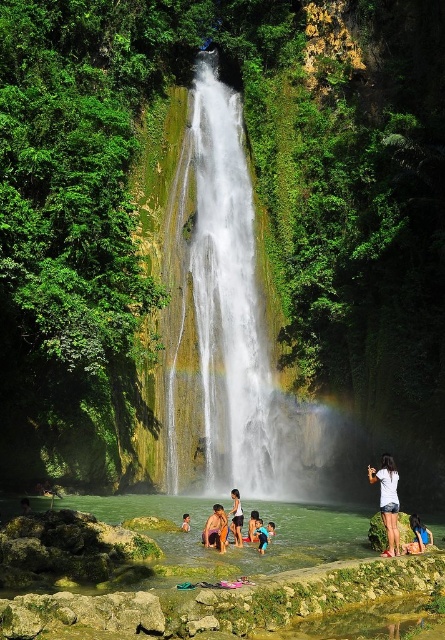
You are a photographer planning to take a picture of the waterfall scene. You notice the white cotton shorts at lower right and the blue wetsuit child at lower center. Which object is covering the other in the image?

The white cotton shorts at lower right is positioned over blue wetsuit child at lower center, so the white cotton shorts at lower right is covering the blue wetsuit child at lower center in the image.

You are a swimmer standing at the edge of the pool near the waterfall. You see the clear water at lower center and the blue fabric swimsuit at lower center. Which object is closer to the bottom of the pool?

The clear water at lower center is located below the blue fabric swimsuit at lower center, so the clear water at lower center is closer to the bottom of the pool.